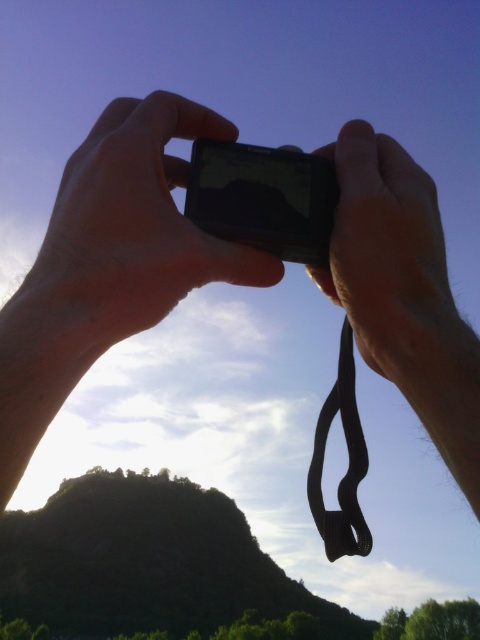
Is matte black camera at center to the left of black glossy smartphone at center from the viewer's perspective?

Indeed, matte black camera at center is positioned on the left side of black glossy smartphone at center.

Is matte black camera at center above black glossy smartphone at center?

Yes.

Who is more distant from viewer, (236,260) or (295,202)?

Positioned behind is point (295,202).

Identify the location of matte black camera at center. This screenshot has width=480, height=640. (123, 236).

Does matte black camera at center have a smaller size compared to black matte camera at center?

No, matte black camera at center is not smaller than black matte camera at center.

Does matte black camera at center have a larger size compared to black matte camera at center?

Yes.

Between point (213, 250) and point (360, 140), which one is positioned behind?

The point (360, 140) is behind.

The width and height of the screenshot is (480, 640). Find the location of `matte black camera at center`. matte black camera at center is located at coordinates (123, 236).

Does black matte camera at center have a smaller size compared to black rubber strap at center?

No, black matte camera at center is not smaller than black rubber strap at center.

Does black matte camera at center come behind black rubber strap at center?

No, it is not.

The image size is (480, 640). Describe the element at coordinates (392, 264) in the screenshot. I see `black matte camera at center` at that location.

Where is `black matte camera at center`? black matte camera at center is located at coordinates (392, 264).